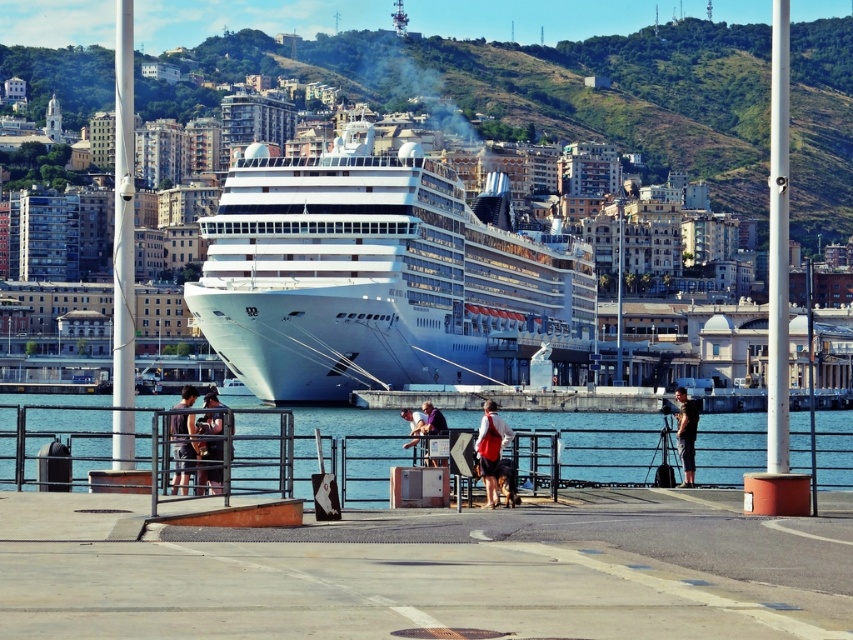
Question: Which point appears closest to the camera in this image?

Choices:
 (A) (491, 484)
 (B) (679, 413)

Answer: (A)

Question: Which object appears farthest from the camera in this image?

Choices:
 (A) dark gray fabric shirt at center
 (B) white cotton shirt at center

Answer: (B)

Question: Is white glossy cruise ship at center to the left of clear blue water at lower center from the viewer's perspective?

Choices:
 (A) yes
 (B) no

Answer: (A)

Question: Is white cotton shirt at center smaller than purple fabric jacket at center?

Choices:
 (A) yes
 (B) no

Answer: (B)

Question: Is white glossy cruise ship at center wider than clear blue water at lower center?

Choices:
 (A) yes
 (B) no

Answer: (B)

Question: Which point is closer to the camera?

Choices:
 (A) matte black jacket at center
 (B) white glossy cruise ship at center
 (C) purple fabric jacket at center

Answer: (A)